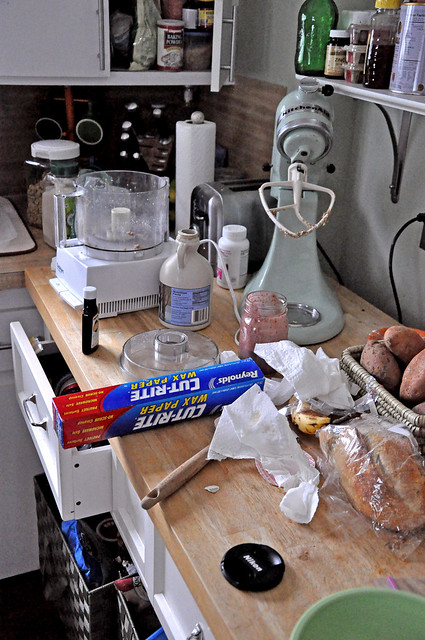
Where is `green bowl`? green bowl is located at coordinates (371, 610).